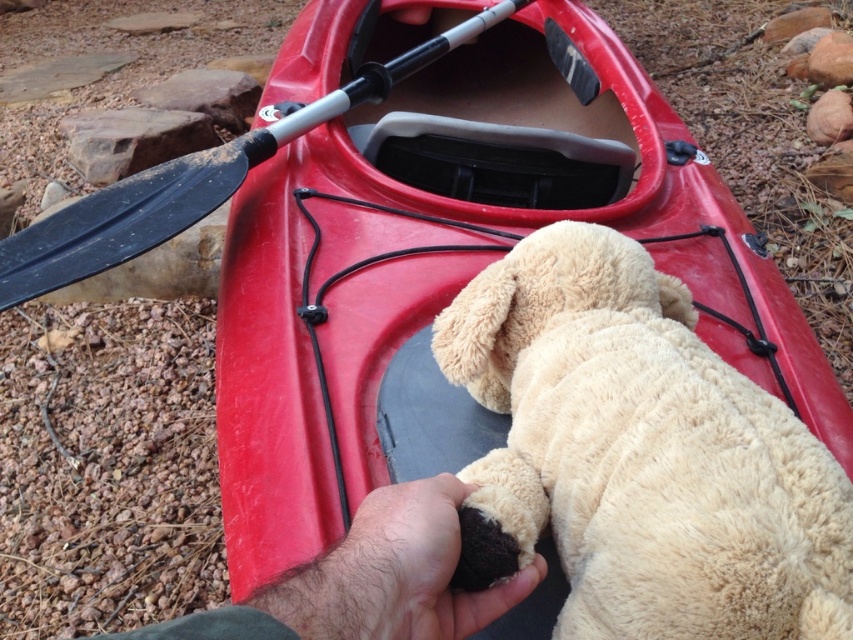
Question: Which of these objects is positioned farthest from the beige plush toy at center?

Choices:
 (A) black rubber paddle at upper left
 (B) rubber kayak at center

Answer: (A)

Question: Which of the following is the farthest from the observer?

Choices:
 (A) (757, 259)
 (B) (525, 358)

Answer: (A)

Question: Estimate the real-world distances between objects in this image. Which object is farther from the hairy hand at lower center?

Choices:
 (A) beige plush toy at center
 (B) rubber kayak at center

Answer: (B)

Question: Is beige plush toy at center thinner than hairy hand at lower center?

Choices:
 (A) no
 (B) yes

Answer: (A)

Question: Can you confirm if hairy hand at lower center is positioned to the left of black rubber paddle at upper left?

Choices:
 (A) yes
 (B) no

Answer: (B)

Question: Is rubber kayak at center smaller than hairy hand at lower center?

Choices:
 (A) yes
 (B) no

Answer: (B)